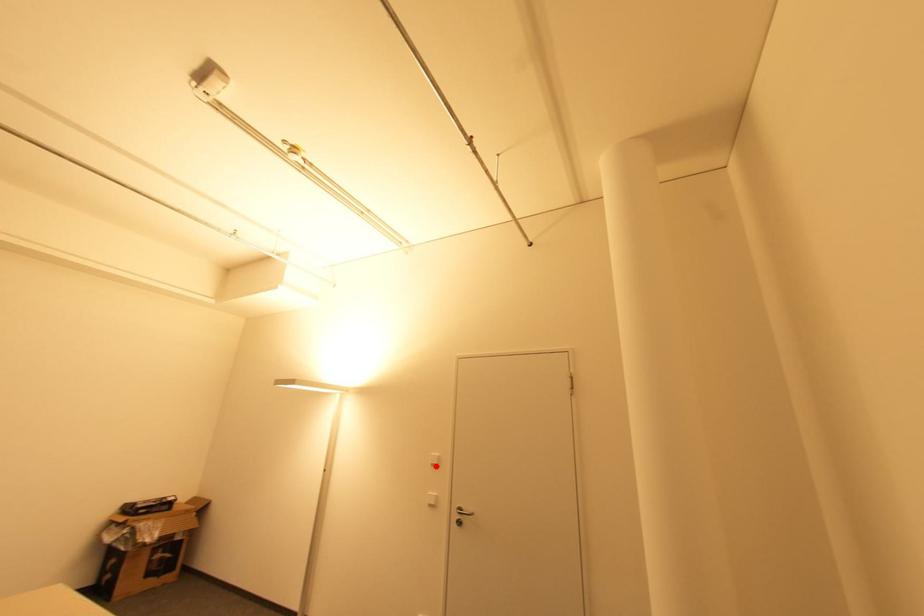
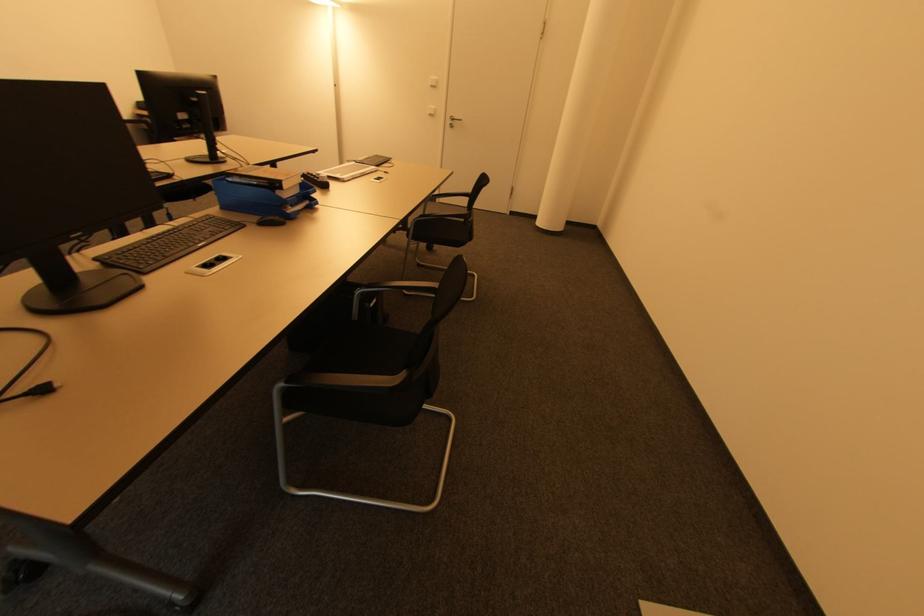
Question: I am providing you with two images of the same scene from different viewpoints. Image1 has a red point marked. In image2, the corresponding 3D location appears at what relative position? Reply with the corresponding letter.

Choices:
 (A) Closer
 (B) Farther

Answer: (A)